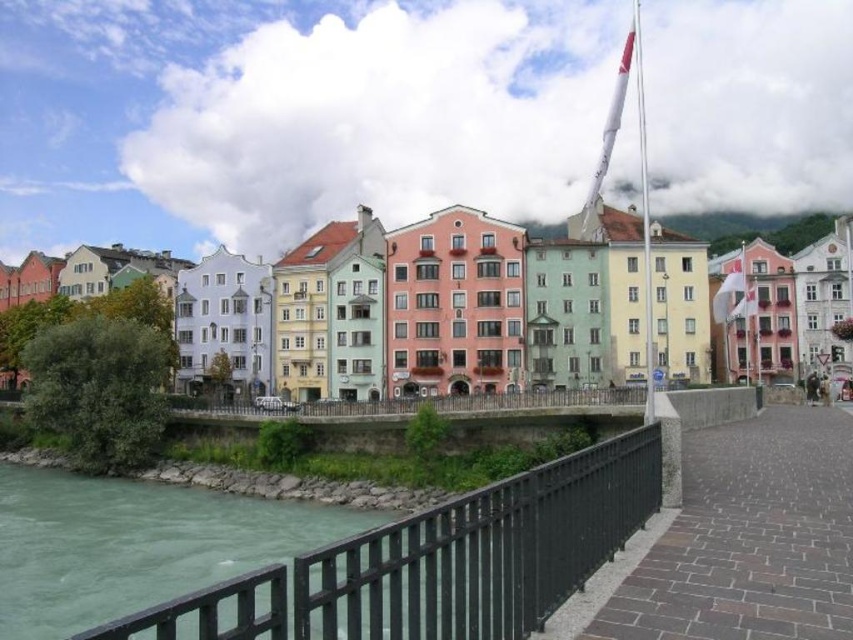
You are standing at the riverside and want to cross to the far bank. The green stone river at lower left is the closest point to you. Can you safely walk across the river at that point if the average depth of the river is 1.5 meters and your height is 1.7 meters?

The green stone river at lower left is 26.88 meters away from viewer. Since the average depth of the river is 1.5 meters and your height is 1.7 meters, you can safely wade across the river at that point as the depth is less than your height.

You are standing at point (x=560, y=545) and want to cross the river to the far bank. The boat you have can carry a maximum of 40 meters. Can you safely cross the river?

The distance between you and the far bank is 41.36 meters, which exceeds the boat capacity of 40 meters. Therefore, you cannot safely cross the river.